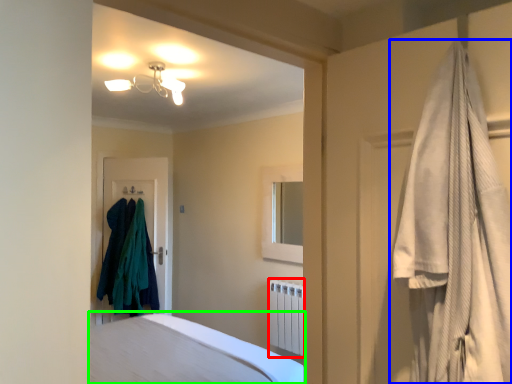
Question: Which object is positioned closest to radiator (highlighted by a red box)? Select from curtain (highlighted by a blue box) and bed (highlighted by a green box).

Choices:
 (A) curtain
 (B) bed

Answer: (B)